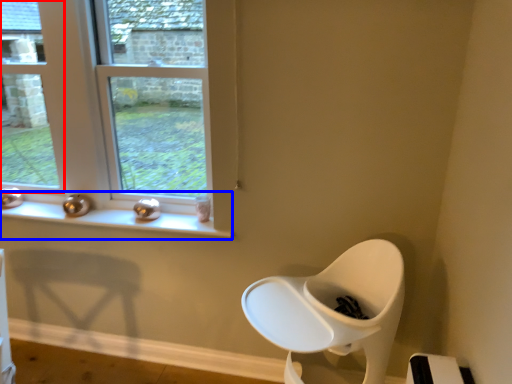
Question: Which point is further to the camera, window (highlighted by a red box) or window sill (highlighted by a blue box)?

Choices:
 (A) window
 (B) window sill

Answer: (A)